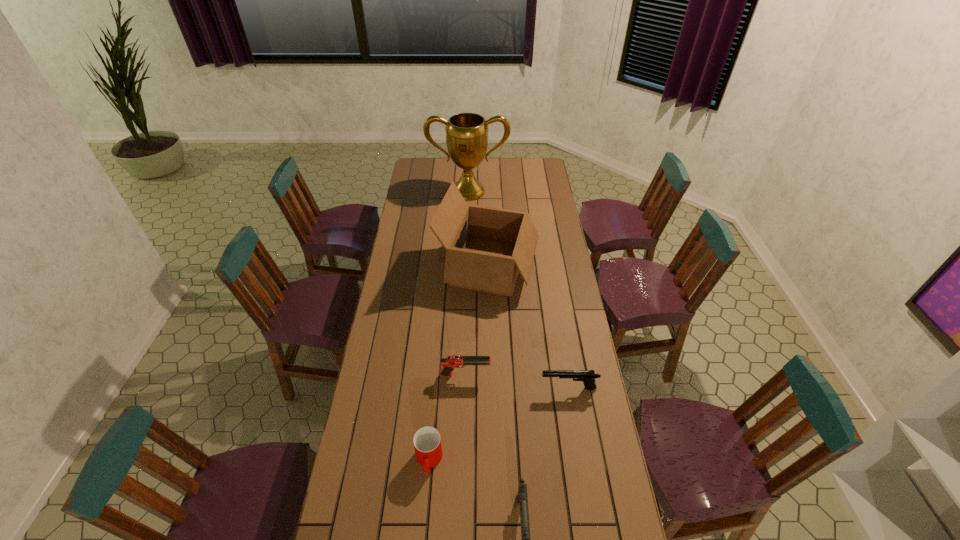
I want to click on the tallest object, so (x=466, y=133).

I want to click on the farthest object, so click(466, 133).

At what (x,y) coordinates should I click in order to perform the action: click on the second tallest object. Please return your answer as a coordinate pair (x, y). Looking at the image, I should click on (486, 247).

Locate an element on the screen. The width and height of the screenshot is (960, 540). the fifth nearest object is located at coordinates (486, 247).

This screenshot has width=960, height=540. I want to click on the third farthest object, so click(453, 361).

Locate an element on the screen. The width and height of the screenshot is (960, 540). the farthest gun is located at coordinates (453, 361).

Identify the location of cup. This screenshot has height=540, width=960. (427, 442).

Identify the location of the third nearest object. The image size is (960, 540). (588, 377).

The width and height of the screenshot is (960, 540). Find the location of `the second nearest gun`. the second nearest gun is located at coordinates (588, 377).

Identify the location of free space located on the surface of the trophy cup with symbols. This screenshot has height=540, width=960. (468, 224).